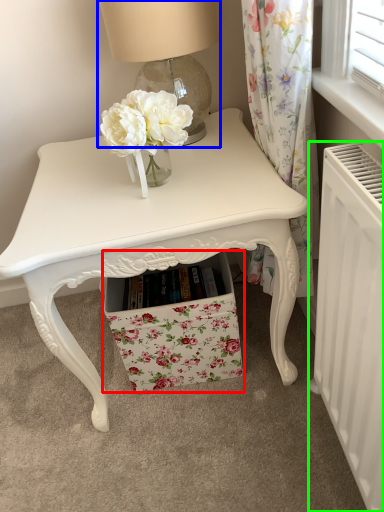
Question: Based on their relative distances, which object is nearer to drawer (highlighted by a red box)? Choose from table lamp (highlighted by a blue box) and radiator (highlighted by a green box).

Choices:
 (A) table lamp
 (B) radiator

Answer: (B)